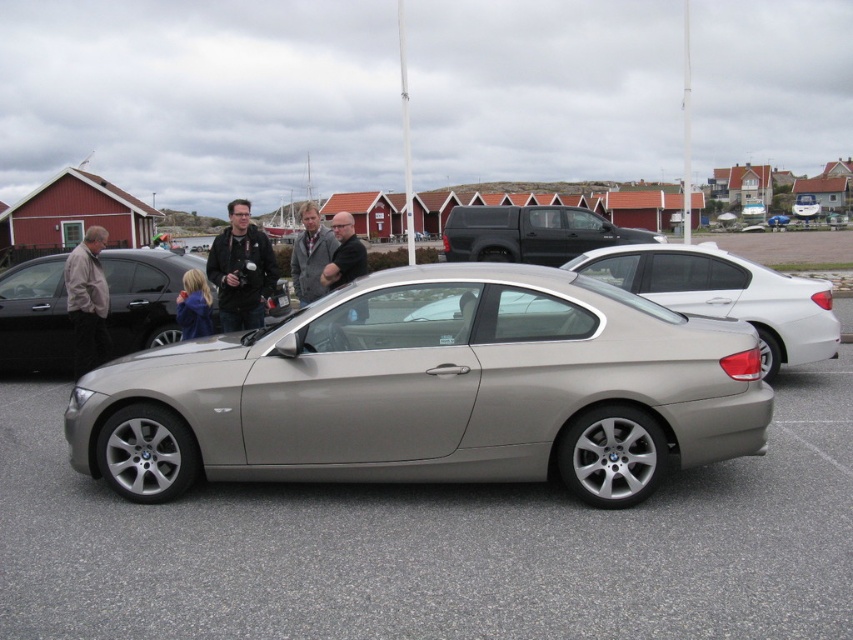
Locate an element on the screen. satin silver car at center is located at coordinates (724, 294).

In the scene shown: Can you confirm if satin silver car at center is taller than light brown leather jacket at left?

In fact, satin silver car at center may be shorter than light brown leather jacket at left.

Is point (796, 320) closer to viewer compared to point (88, 362)?

That is True.

I want to click on satin silver car at center, so click(x=724, y=294).

Looking at this image, does light brown leather jacket at left appear over dark gray jacket at center?

No.

Can you confirm if light brown leather jacket at left is taller than dark gray jacket at center?

In fact, light brown leather jacket at left may be shorter than dark gray jacket at center.

Measure the distance between light brown leather jacket at left and camera.

The distance of light brown leather jacket at left from camera is 29.08 feet.

Where is `light brown leather jacket at left`? light brown leather jacket at left is located at coordinates (86, 300).

Can you confirm if satin metallic car at center is shorter than light brown leather jacket at left?

Correct, satin metallic car at center is not as tall as light brown leather jacket at left.

Which is more to the right, satin metallic car at center or light brown leather jacket at left?

satin metallic car at center is more to the right.

Is point (497, 460) positioned behind point (96, 298)?

No.

What are the coordinates of `satin metallic car at center` in the screenshot? It's located at (432, 390).